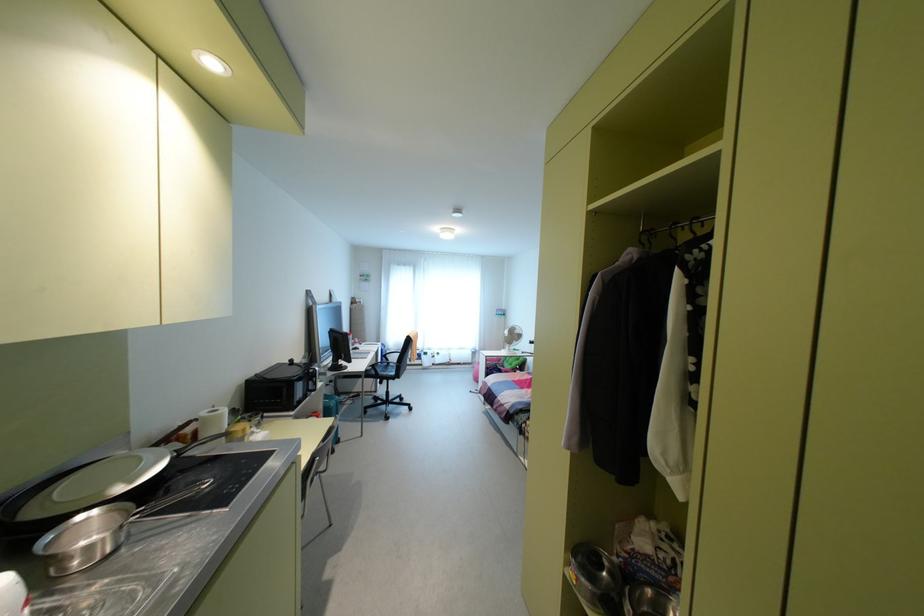
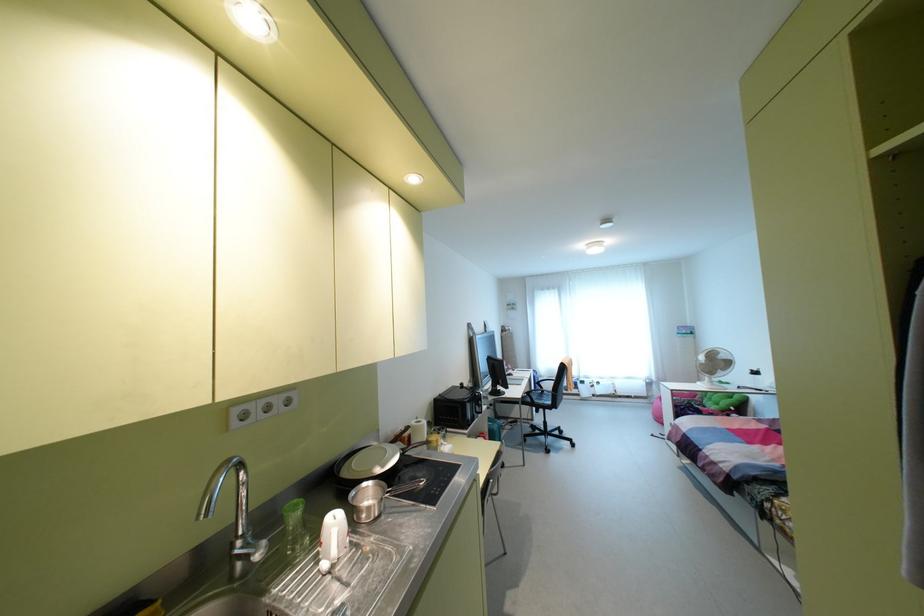
Question: The first image is from the beginning of the video and the second image is from the end. How did the camera likely rotate when shooting the video?

Choices:
 (A) Left
 (B) Right
 (C) Up
 (D) Down

Answer: (A)